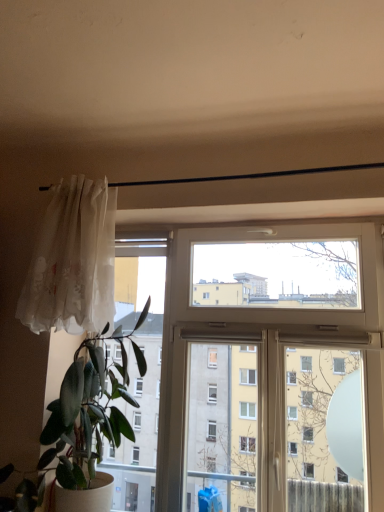
Question: Does translucent white curtain at left have a larger size compared to green matte plant at left?

Choices:
 (A) yes
 (B) no

Answer: (B)

Question: Is translucent white curtain at left beside green matte plant at left?

Choices:
 (A) yes
 (B) no

Answer: (B)

Question: Can you confirm if translucent white curtain at left is taller than green matte plant at left?

Choices:
 (A) yes
 (B) no

Answer: (B)

Question: Is translucent white curtain at left shorter than green matte plant at left?

Choices:
 (A) no
 (B) yes

Answer: (B)

Question: Is translucent white curtain at left surrounding green matte plant at left?

Choices:
 (A) yes
 (B) no

Answer: (B)

Question: Considering the relative positions of translucent white curtain at left and green matte plant at left in the image provided, is translucent white curtain at left to the left or to the right of green matte plant at left?

Choices:
 (A) right
 (B) left

Answer: (B)

Question: From a real-world perspective, is translucent white curtain at left positioned above or below green matte plant at left?

Choices:
 (A) above
 (B) below

Answer: (A)

Question: From the image's perspective, is translucent white curtain at left above or below green matte plant at left?

Choices:
 (A) above
 (B) below

Answer: (A)

Question: Considering the positions of translucent white curtain at left and green matte plant at left in the image, is translucent white curtain at left wider or thinner than green matte plant at left?

Choices:
 (A) thin
 (B) wide

Answer: (A)

Question: Considering the positions of translucent white curtain at left and white plastic window at center in the image, is translucent white curtain at left taller or shorter than white plastic window at center?

Choices:
 (A) tall
 (B) short

Answer: (B)

Question: Looking at the image, does translucent white curtain at left seem bigger or smaller compared to white plastic window at center?

Choices:
 (A) small
 (B) big

Answer: (A)

Question: Is translucent white curtain at left in front of or behind white plastic window at center in the image?

Choices:
 (A) behind
 (B) front

Answer: (A)

Question: From a real-world perspective, is translucent white curtain at left above or below white plastic window at center?

Choices:
 (A) below
 (B) above

Answer: (B)

Question: In terms of size, does green matte plant at left appear bigger or smaller than translucent white curtain at left?

Choices:
 (A) small
 (B) big

Answer: (B)

Question: From the image's perspective, is green matte plant at left above or below translucent white curtain at left?

Choices:
 (A) below
 (B) above

Answer: (A)